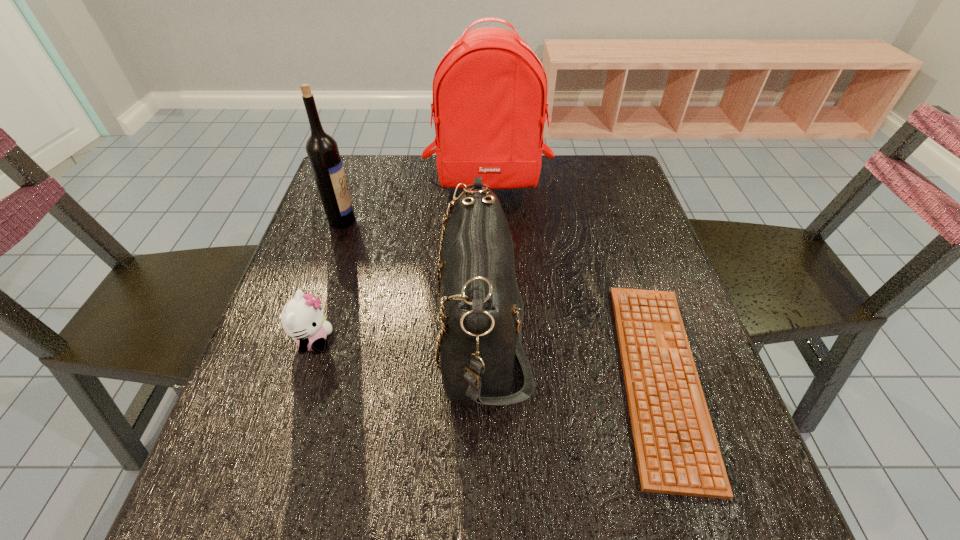
This screenshot has width=960, height=540. I want to click on free point located 0.130m at the front of the third shortest object with chain and zipper, so click(x=373, y=328).

At what (x,y) coordinates should I click in order to perform the action: click on vacant space located at the front of the third shortest object with chain and zipper. Please return your answer as a coordinate pair (x, y). Looking at the image, I should click on (295, 328).

Where is `vacant region located at the front of the third shortest object with chain and zipper`? The image size is (960, 540). vacant region located at the front of the third shortest object with chain and zipper is located at coordinates (271, 328).

At what (x,y) coordinates should I click in order to perform the action: click on vacant region located 0.050m on the front-facing side of the kitten. Please return your answer as a coordinate pair (x, y). Looking at the image, I should click on (358, 341).

The image size is (960, 540). I want to click on free location located 0.120m on the left of the rightmost object, so click(x=550, y=377).

The image size is (960, 540). Find the location of `object located in the far edge section of the desktop`. object located in the far edge section of the desktop is located at coordinates (489, 93).

This screenshot has width=960, height=540. I want to click on object that is at the near edge, so [x=677, y=451].

Where is `wine bottle present at the left edge`? The image size is (960, 540). wine bottle present at the left edge is located at coordinates (322, 150).

Where is `kitten located in the left edge section of the desktop`? The image size is (960, 540). kitten located in the left edge section of the desktop is located at coordinates (302, 318).

This screenshot has height=540, width=960. I want to click on object present at the right edge, so click(677, 451).